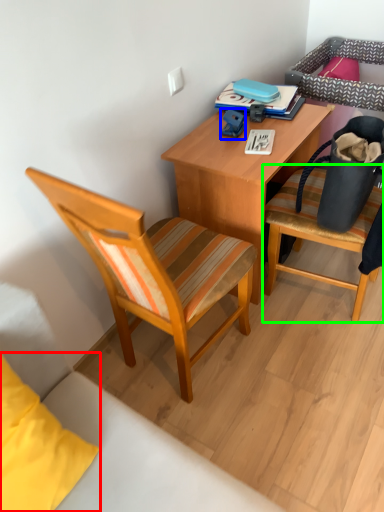
Question: Estimate the real-world distances between objects in this image. Which object is closer to pillow (highlighted by a red box), toy (highlighted by a blue box) or chair (highlighted by a green box)?

Choices:
 (A) toy
 (B) chair

Answer: (B)